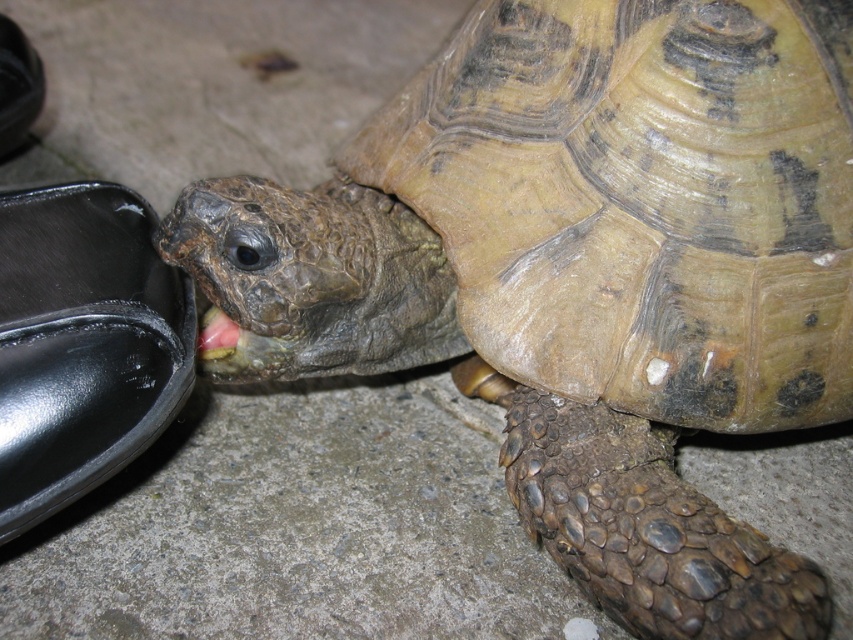
Question: Does shiny black shoe at lower left have a greater width compared to black leather shoe at left?

Choices:
 (A) no
 (B) yes

Answer: (B)

Question: Is shiny black shoe at lower left bigger than black leather shoe at left?

Choices:
 (A) yes
 (B) no

Answer: (A)

Question: Among these points, which one is farthest from the camera?

Choices:
 (A) (28, 116)
 (B) (84, 262)

Answer: (A)

Question: Observing the image, what is the correct spatial positioning of shiny black shoe at lower left in reference to black leather shoe at left?

Choices:
 (A) above
 (B) below

Answer: (B)

Question: Which point appears closest to the camera in this image?

Choices:
 (A) (138, 371)
 (B) (0, 96)

Answer: (A)